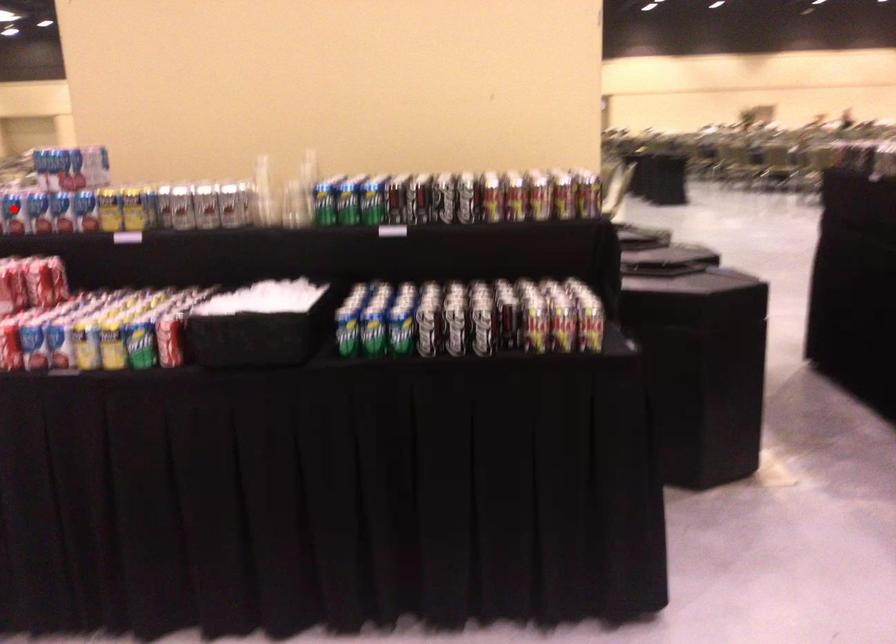
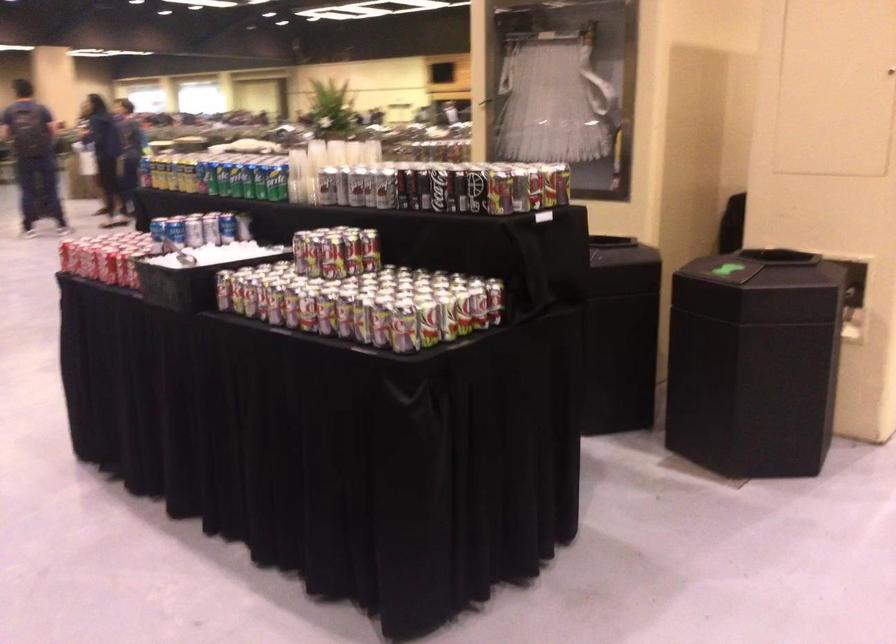
Question: I am providing you with two images of the same scene from different viewpoints. A red point is marked on the first image. At the location where the point appears in image 1, is it still visible in image 2?

Choices:
 (A) Yes
 (B) No

Answer: (B)